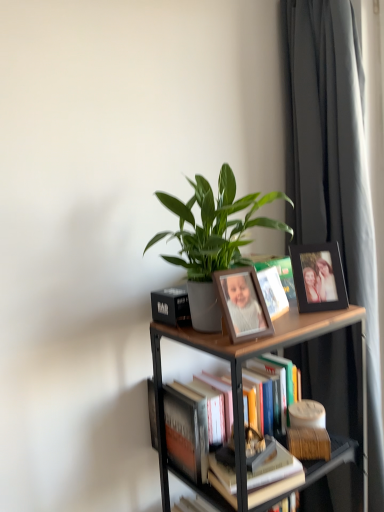
Question: Does hardcover book at center, which is counted as the second book, starting from the back, turn towards hardcover books at center, which is counted as the first book, starting from the back?

Choices:
 (A) no
 (B) yes

Answer: (A)

Question: From a real-world perspective, is hardcover book at center, which is counted as the second book, starting from the back, positioned over hardcover books at center, the 2th book when ordered from front to back, based on gravity?

Choices:
 (A) no
 (B) yes

Answer: (A)

Question: Is the depth of hardcover book at center, positioned as the 1th book in front-to-back order, greater than that of hardcover books at center, which is counted as the first book, starting from the back?

Choices:
 (A) yes
 (B) no

Answer: (B)

Question: Is hardcover book at center, which is counted as the second book, starting from the back, far away from hardcover books at center, the 2th book when ordered from front to back?

Choices:
 (A) no
 (B) yes

Answer: (A)

Question: From the image's perspective, is hardcover book at center, positioned as the 1th book in front-to-back order, located beneath hardcover books at center, which is counted as the first book, starting from the back?

Choices:
 (A) no
 (B) yes

Answer: (B)

Question: Considering their positions, is hardcover book at center, which is counted as the second book, starting from the back, located in front of or behind black matte picture frame at upper right, marked as the second picture frame in a front-to-back arrangement?

Choices:
 (A) behind
 (B) front

Answer: (B)

Question: In terms of height, does hardcover book at center, positioned as the 1th book in front-to-back order, look taller or shorter compared to black matte picture frame at upper right, positioned as the first picture frame in back-to-front order?

Choices:
 (A) tall
 (B) short

Answer: (B)

Question: Considering the positions of point (292, 466) and point (321, 271), is point (292, 466) closer or farther from the camera than point (321, 271)?

Choices:
 (A) farther
 (B) closer

Answer: (B)

Question: Is hardcover book at center, which is counted as the second book, starting from the back, bigger or smaller than black matte picture frame at upper right, which is counted as the 2th picture frame, starting from the left?

Choices:
 (A) small
 (B) big

Answer: (B)

Question: Choose the correct answer: Is woodenmaterial/textureshelf at upper center inside matte white book at center or outside it?

Choices:
 (A) outside
 (B) inside

Answer: (A)

Question: Relative to matte white book at center, is woodenmaterial/textureshelf at upper center in front or behind?

Choices:
 (A) front
 (B) behind

Answer: (A)

Question: Visually, is woodenmaterial/textureshelf at upper center positioned to the left or to the right of matte white book at center?

Choices:
 (A) left
 (B) right

Answer: (A)

Question: Looking at their shapes, would you say woodenmaterial/textureshelf at upper center is wider or thinner than matte white book at center?

Choices:
 (A) thin
 (B) wide

Answer: (B)

Question: Is point (311, 300) positioned closer to the camera than point (259, 306)?

Choices:
 (A) closer
 (B) farther

Answer: (B)

Question: Looking at their shapes, would you say black matte picture frame at upper right, which is counted as the 2th picture frame, starting from the left, is wider or thinner than wooden photo frame at center, the 1th picture frame positioned from the front?

Choices:
 (A) wide
 (B) thin

Answer: (A)